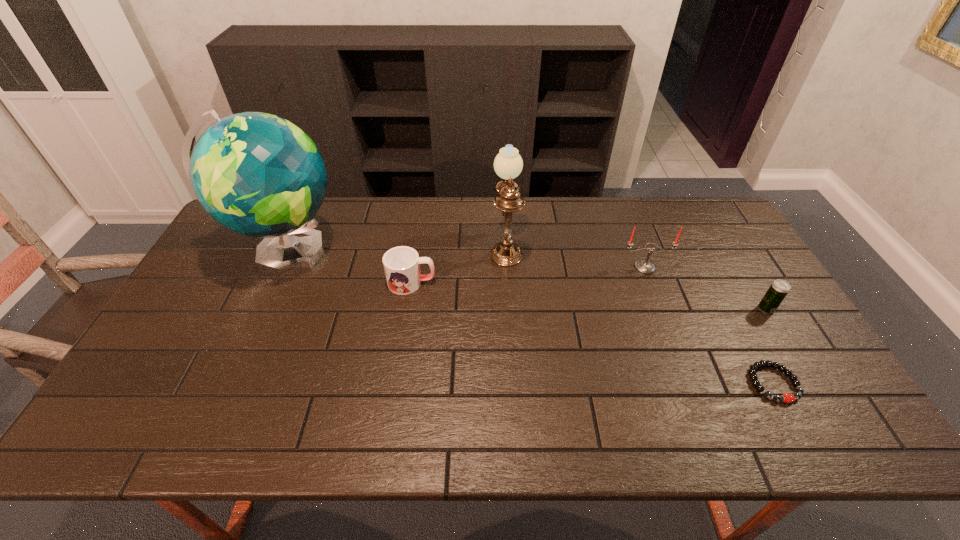
Identify the location of the nearest object. The height and width of the screenshot is (540, 960). (787, 398).

Image resolution: width=960 pixels, height=540 pixels. I want to click on blank space located 0.320m on the front surface of the tallest object, so click(444, 253).

I want to click on vacant space located on the left of the second tallest object, so click(x=442, y=245).

Locate an element on the screen. The width and height of the screenshot is (960, 540). vacant space located on the front-facing side of the candle is located at coordinates (679, 355).

This screenshot has height=540, width=960. Identify the location of vacant space located 0.200m on the side of the second object from left to right with the handle. (502, 282).

Where is `vacant space located 0.170m on the back of the fifth farthest object`? vacant space located 0.170m on the back of the fifth farthest object is located at coordinates (738, 262).

Identify the location of free space located 0.220m on the back of the shortest object. The image size is (960, 540). (728, 299).

Image resolution: width=960 pixels, height=540 pixels. Find the location of `globe at the far edge`. globe at the far edge is located at coordinates (257, 174).

In order to click on oil lamp that is at the far edge in this screenshot , I will do `click(508, 164)`.

This screenshot has width=960, height=540. Identify the location of object that is positioned at the left edge. (257, 174).